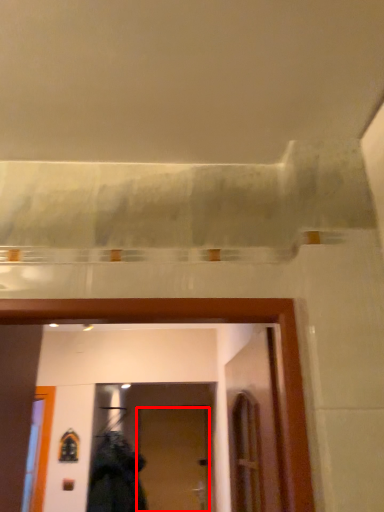
Question: From the image's perspective, what is the correct spatial relationship of door (annotated by the red box) in relation to clothing?

Choices:
 (A) above
 (B) below

Answer: (B)